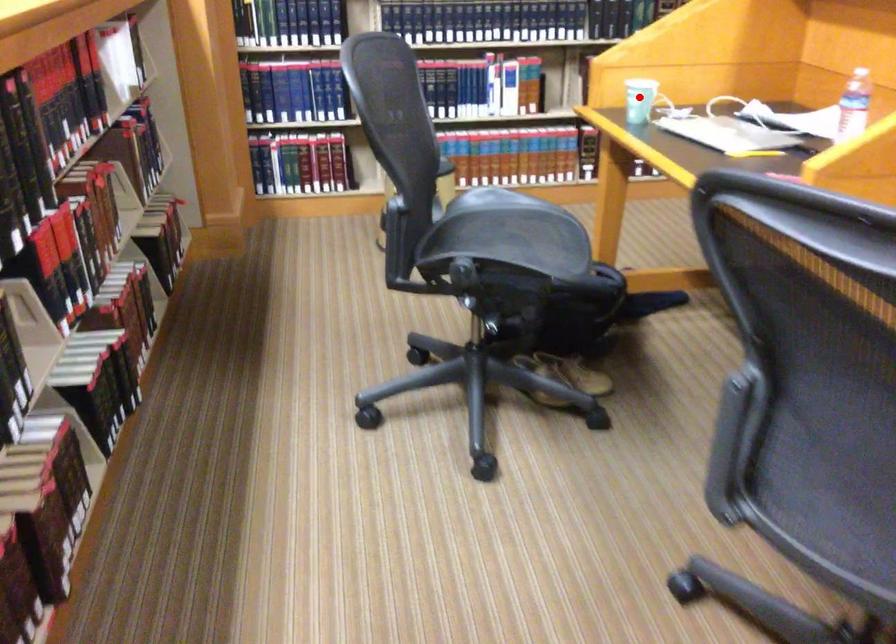
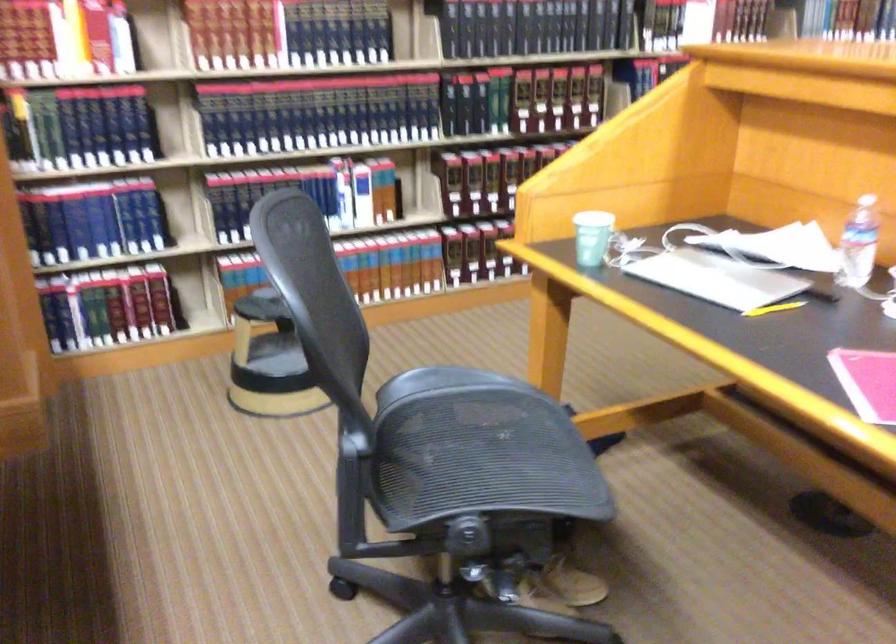
Question: I am providing you with two images of the same scene from different viewpoints. A red point is shown in image1. For the corresponding object point in image2, is it positioned nearer or farther from the camera?

Choices:
 (A) Nearer
 (B) Farther

Answer: (A)